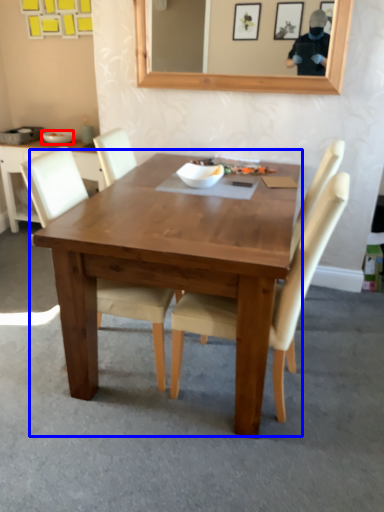
Question: Which object appears closest to the camera in this image, bowl (highlighted by a red box) or kitchen & dining room table (highlighted by a blue box)?

Choices:
 (A) bowl
 (B) kitchen & dining room table

Answer: (B)